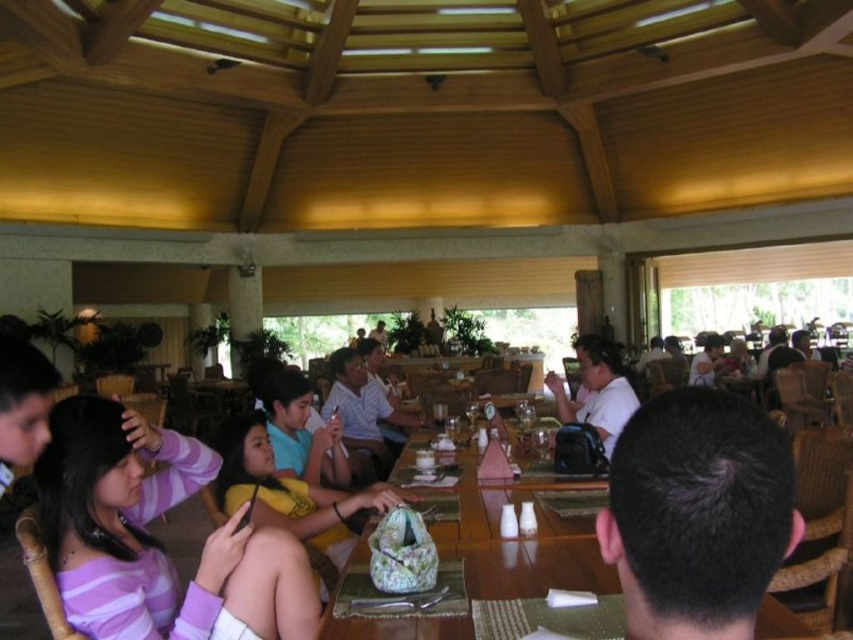
Who is taller, matte blue shirt at center or matte white shirt at center?

matte white shirt at center

Is matte blue shirt at center shorter than matte white shirt at center?

Yes.

Is point (288, 440) in front of point (613, 342)?

Yes, it is.

What are the coordinates of `matte blue shirt at center` in the screenshot? It's located at (300, 429).

Can you confirm if floral fabric bag at center is thinner than matte blue shirt at center?

No, floral fabric bag at center is not thinner than matte blue shirt at center.

Is point (469, 584) positioned before point (305, 403)?

Yes, point (469, 584) is closer to viewer.

I want to click on floral fabric bag at center, so click(x=520, y=552).

Which is in front, point (125, 540) or point (619, 412)?

Point (125, 540) is in front.

Does striped fabric shirt at left appear over matte white shirt at center?

Answer: No.

This screenshot has height=640, width=853. I want to click on striped fabric shirt at left, so click(154, 538).